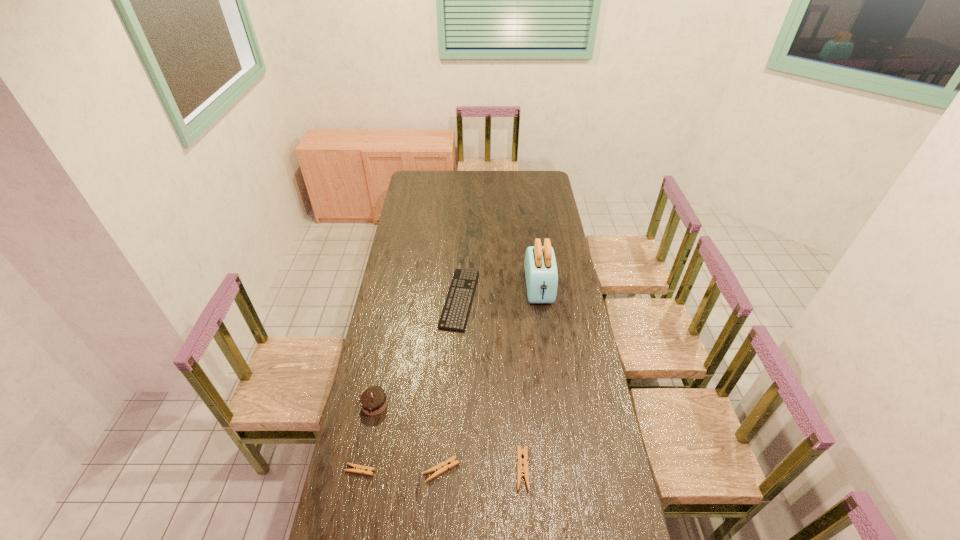
All clothespins are currently evenly spaced. To continue this pattern, where would you add another clothespin on the right? Please point out a vacant spot. Please provide its 2D coordinates. Your answer should be formatted as a tuple, i.e. [(x, y)], where the tuple contains the x and y coordinates of a point satisfying the conditions above.

[(603, 469)]